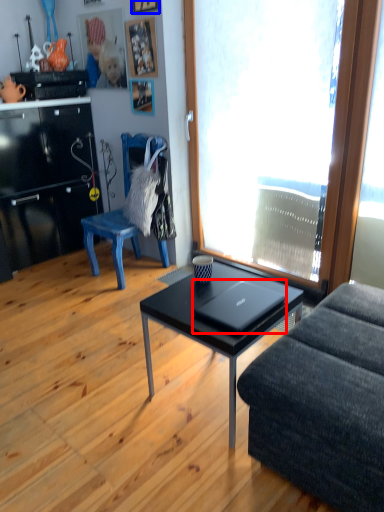
Question: Which of the following is the closest to the observer, laptop (highlighted by a red box) or picture frame (highlighted by a blue box)?

Choices:
 (A) laptop
 (B) picture frame

Answer: (A)